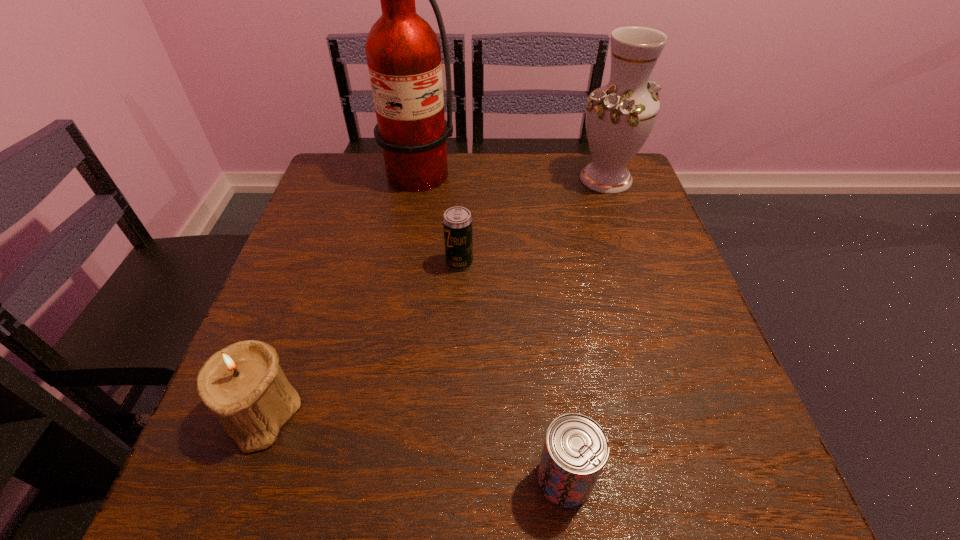
Locate an element on the screen. The image size is (960, 540). fire extinguisher is located at coordinates (403, 53).

You are a GUI agent. You are given a task and a screenshot of the screen. Output one action in this format:
    pyautogui.click(x=<x>, y=<y>)
    Task: Click on the rightmost object
    
    Given the screenshot: What is the action you would take?
    pyautogui.click(x=620, y=116)

At what (x,y) coordinates should I click in order to perform the action: click on the fourth shortest object. Please return your answer as a coordinate pair (x, y). Looking at the image, I should click on (620, 116).

Where is `the third tallest object`? This screenshot has width=960, height=540. the third tallest object is located at coordinates click(x=242, y=383).

What are the coordinates of `the farther beer can` in the screenshot? It's located at (457, 222).

Locate an element on the screen. This screenshot has height=540, width=960. the left beer can is located at coordinates (457, 222).

This screenshot has width=960, height=540. I want to click on the right beer can, so click(x=576, y=448).

The image size is (960, 540). Find the location of `the nearer beer can`. the nearer beer can is located at coordinates (576, 448).

The height and width of the screenshot is (540, 960). In order to click on vacant space located 0.320m on the nozzle and handle of the fire extinguisher in this screenshot , I will do `click(378, 290)`.

This screenshot has height=540, width=960. Identify the location of vacant space located on the left of the second tallest object. [461, 179].